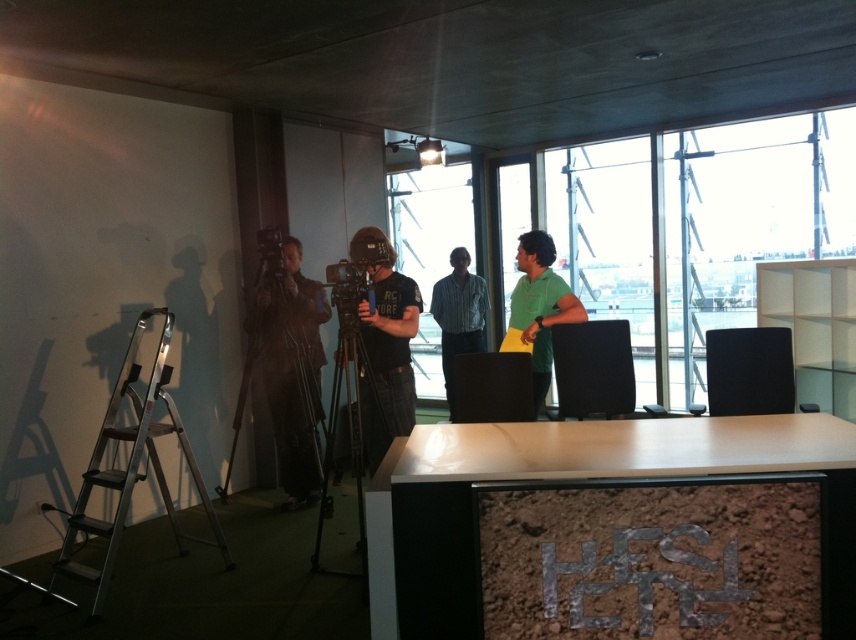
Based on the photo, between green matte shirt at center and striped shirt at center, which one has more height?

With more height is striped shirt at center.

Does point (521, 326) come in front of point (480, 352)?

That is True.

This screenshot has width=856, height=640. Find the location of `green matte shirt at center`. green matte shirt at center is located at coordinates (539, 305).

Can you confirm if silver metallic ladder at left is positioned below green matte shirt at center?

Yes, silver metallic ladder at left is below green matte shirt at center.

Can you confirm if silver metallic ladder at left is thinner than green matte shirt at center?

In fact, silver metallic ladder at left might be wider than green matte shirt at center.

Locate an element on the screen. silver metallic ladder at left is located at coordinates (134, 465).

At what (x,y) coordinates should I click in order to perform the action: click on silver metallic ladder at left. Please return your answer as a coordinate pair (x, y). The width and height of the screenshot is (856, 640). Looking at the image, I should click on (134, 465).

Who is more forward, (253, 300) or (539, 259)?

Positioned in front is point (539, 259).

Who is shorter, dark brown leather jacket at left or green matte shirt at center?

With less height is green matte shirt at center.

Who is more distant from viewer, (265, 384) or (538, 376)?

Positioned behind is point (265, 384).

You are a GUI agent. You are given a task and a screenshot of the screen. Output one action in this format:
    pyautogui.click(x=<x>, y=<y>)
    Task: Click on the dark brown leather jacket at left
    
    Given the screenshot: What is the action you would take?
    pyautogui.click(x=290, y=368)